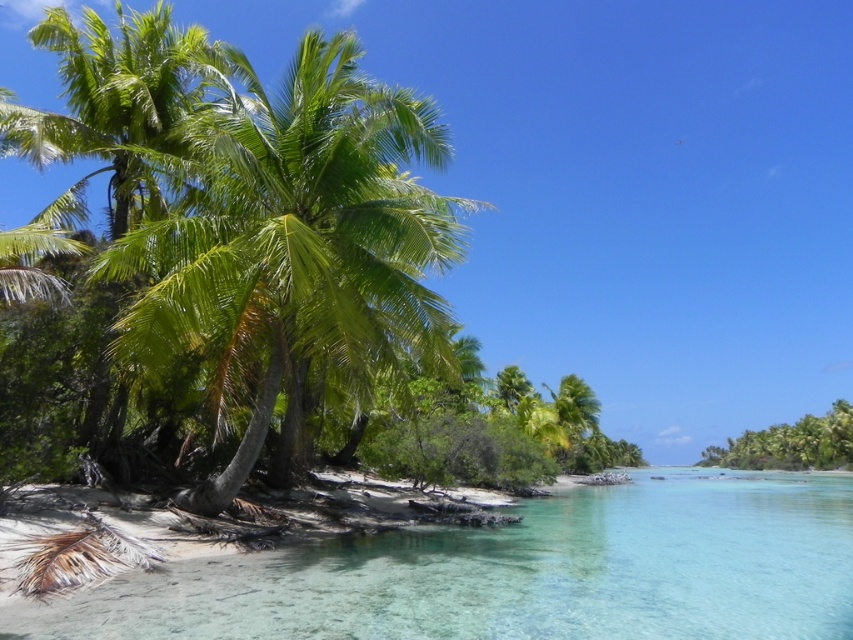
Is the position of clear glass water at lower left more distant than that of green leafy palm tree at left?

No, it is in front of green leafy palm tree at left.

Is point (657, 520) positioned in front of point (265, 289)?

No, (657, 520) is behind (265, 289).

This screenshot has width=853, height=640. Find the location of `clear glass water at lower left`. clear glass water at lower left is located at coordinates (519, 573).